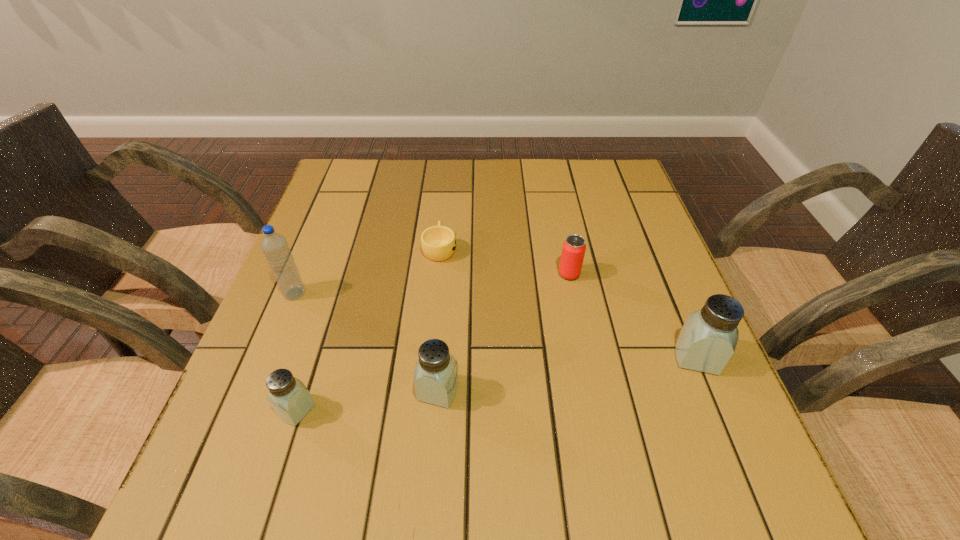
Find the location of a particular element. beer can is located at coordinates (574, 247).

The image size is (960, 540). Find the location of `the second object from right to left`. the second object from right to left is located at coordinates (574, 247).

Locate an element on the screen. This screenshot has height=540, width=960. free space located on the right of the leftmost saltshaker is located at coordinates (484, 410).

Find the location of a particular element. The height and width of the screenshot is (540, 960). vacant space located on the back of the third tallest object is located at coordinates (447, 268).

The width and height of the screenshot is (960, 540). Identify the location of vacant space situated on the left of the tallest saltshaker. (623, 357).

This screenshot has height=540, width=960. Find the location of `vacant region located on the left of the farthest object`. vacant region located on the left of the farthest object is located at coordinates (304, 248).

Where is `free spot located on the back of the fourth nearest object`? free spot located on the back of the fourth nearest object is located at coordinates (332, 200).

Locate an element on the screen. vacant space situated 0.310m on the front of the second object from right to left is located at coordinates (596, 406).

Image resolution: width=960 pixels, height=540 pixels. In order to click on saltshaker at the left edge in this screenshot , I will do `click(290, 399)`.

What are the coordinates of `water bottle that is at the left edge` in the screenshot? It's located at (275, 247).